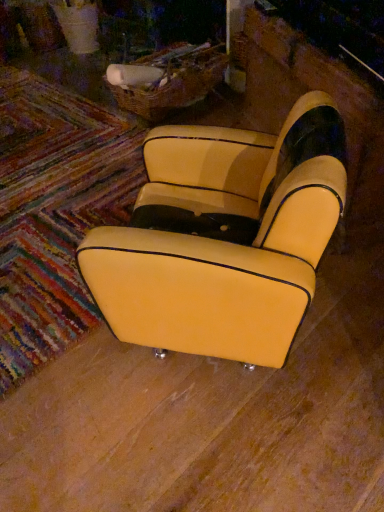
Question: Does yellow leather armchair at center appear on the left side of yellow leather mat at lower left?

Choices:
 (A) yes
 (B) no

Answer: (B)

Question: Is yellow leather armchair at center positioned beyond the bounds of yellow leather mat at lower left?

Choices:
 (A) no
 (B) yes

Answer: (B)

Question: Could you tell me if yellow leather armchair at center is facing yellow leather mat at lower left?

Choices:
 (A) no
 (B) yes

Answer: (A)

Question: Can you confirm if yellow leather armchair at center is shorter than yellow leather mat at lower left?

Choices:
 (A) no
 (B) yes

Answer: (A)

Question: Are yellow leather armchair at center and yellow leather mat at lower left beside each other?

Choices:
 (A) no
 (B) yes

Answer: (A)

Question: Is yellow leather armchair at center closer to the viewer compared to yellow leather mat at lower left?

Choices:
 (A) yes
 (B) no

Answer: (A)

Question: From a real-world perspective, is yellow leather mat at lower left located higher than yellow leather armchair at center?

Choices:
 (A) no
 (B) yes

Answer: (A)

Question: Is yellow leather mat at lower left turned away from yellow leather armchair at center?

Choices:
 (A) yes
 (B) no

Answer: (B)

Question: Is yellow leather mat at lower left positioned behind yellow leather armchair at center?

Choices:
 (A) no
 (B) yes

Answer: (B)

Question: Could you tell me if yellow leather mat at lower left is facing yellow leather armchair at center?

Choices:
 (A) no
 (B) yes

Answer: (A)

Question: From the image's perspective, is yellow leather mat at lower left located above yellow leather armchair at center?

Choices:
 (A) no
 (B) yes

Answer: (B)

Question: Is yellow leather mat at lower left located outside yellow leather armchair at center?

Choices:
 (A) yes
 (B) no

Answer: (A)

Question: Considering the positions of yellow leather armchair at center and yellow leather mat at lower left in the image, is yellow leather armchair at center wider or thinner than yellow leather mat at lower left?

Choices:
 (A) thin
 (B) wide

Answer: (A)